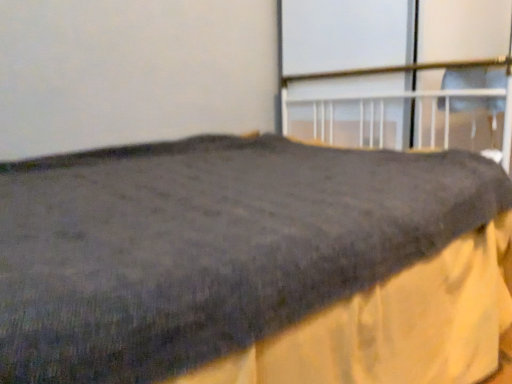
Looking at this image, in order to face dark fabric bed at center, should I rotate leftwards or rightwards?

You should look left and rotate roughly 2.743 degrees.

You are a GUI agent. You are given a task and a screenshot of the screen. Output one action in this format:
    pyautogui.click(x=<x>, y=<y>)
    Task: Click on the dark fabric bed at center
    
    Given the screenshot: What is the action you would take?
    pyautogui.click(x=253, y=265)

What do you see at coordinates (253, 265) in the screenshot? The width and height of the screenshot is (512, 384). I see `dark fabric bed at center` at bounding box center [253, 265].

At what (x,y) coordinates should I click in order to perform the action: click on dark fabric bed at center. Please return your answer as a coordinate pair (x, y). The height and width of the screenshot is (384, 512). Looking at the image, I should click on (253, 265).